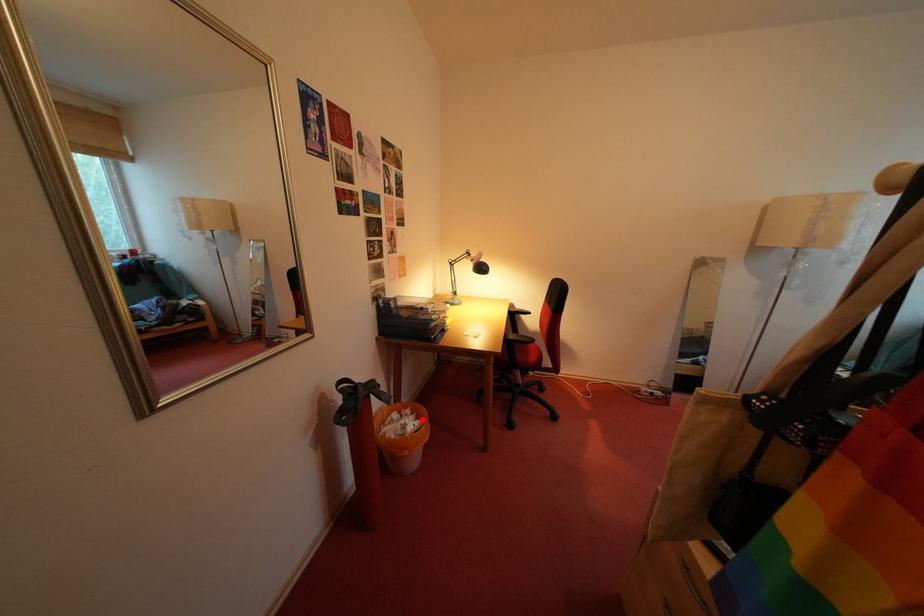
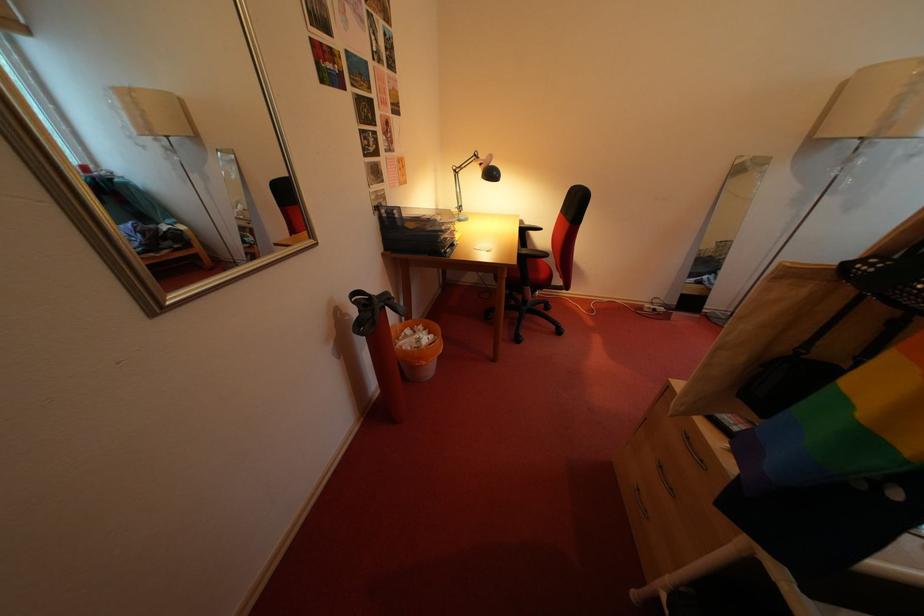
Find the pixel in the second image that matches the highlighted location in the first image.

(434, 334)